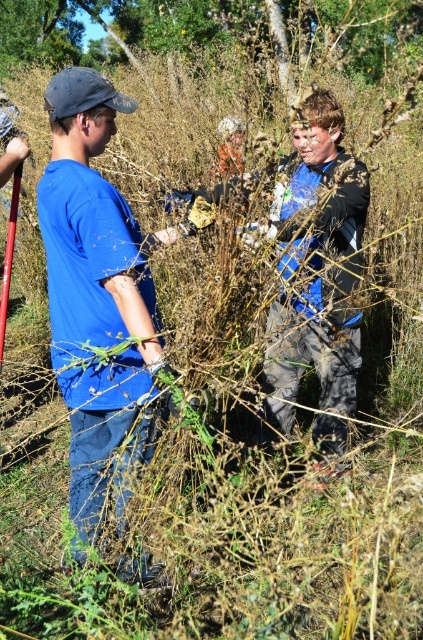
You are a photographer trying to capture a photo of the blue cotton shirt at left and the green leafy tree at upper center. Which object is shorter in the scene?

The blue cotton shirt at left is not as tall as the green leafy tree at upper center, so the blue cotton shirt at left is shorter.

You are a photographer trying to capture the blue cotton shirt at left and the green leafy tree at upper center in the same frame. Based on their sizes, which object should you focus on first to ensure both are in focus?

The blue cotton shirt at left has a smaller size compared to the green leafy tree at upper center, so you should focus on the larger green leafy tree at upper center first to ensure both are in focus.